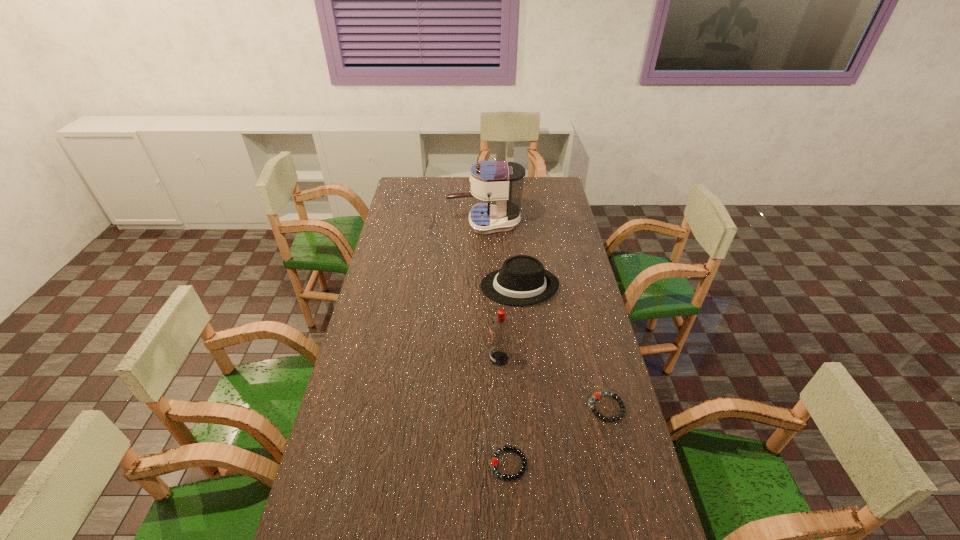
The height and width of the screenshot is (540, 960). I want to click on coffee maker, so click(501, 181).

Locate an element on the screen. the tallest object is located at coordinates (501, 181).

Identify the location of the third nearest object. This screenshot has height=540, width=960. (500, 328).

You are a GUI agent. You are given a task and a screenshot of the screen. Output one action in this format:
    pyautogui.click(x=<x>, y=<y>)
    Task: Click on the second tallest object
    This screenshot has height=540, width=960.
    Given the screenshot: What is the action you would take?
    pyautogui.click(x=500, y=328)

The height and width of the screenshot is (540, 960). Identify the location of the third tallest object. coord(522,280).

You are a GUI agent. You are given a task and a screenshot of the screen. Output one action in this format:
    pyautogui.click(x=<x>, y=<y>)
    Task: Click on the fedora
    Image resolution: width=960 pixels, height=540 pixels.
    Given the screenshot: What is the action you would take?
    pyautogui.click(x=522, y=280)

You are a GUI agent. You are given a task and a screenshot of the screen. Output one action in this format:
    pyautogui.click(x=<x>, y=<y>)
    Task: Click on the fourth farthest object
    The image size is (960, 540).
    Given the screenshot: What is the action you would take?
    pyautogui.click(x=597, y=395)

Image resolution: width=960 pixels, height=540 pixels. Identify the location of the farther bracelet. (597, 395).

I want to click on the nearer bracelet, so click(494, 461).

Locate an element on the screen. This screenshot has width=960, height=540. the left bracelet is located at coordinates (494, 461).